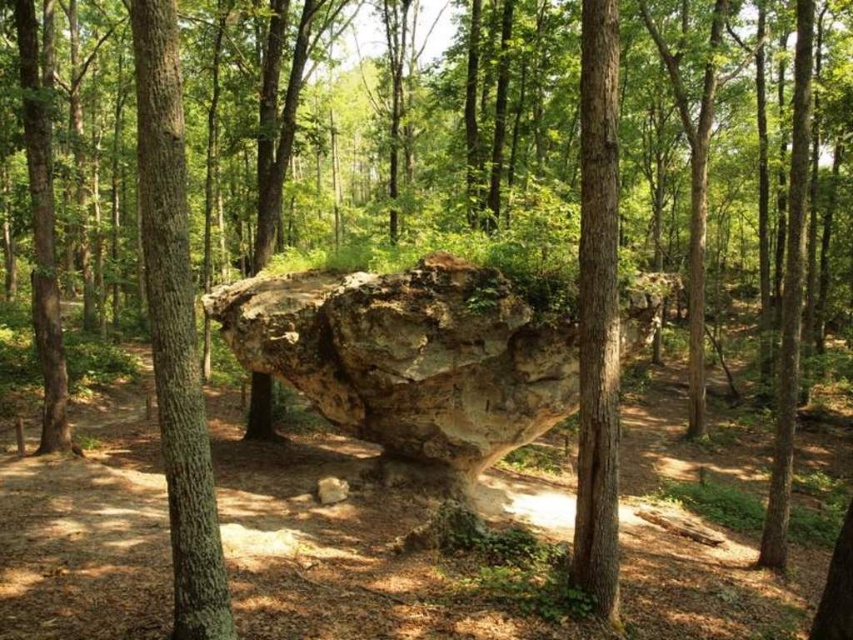
Question: Is brown rough tree trunk at center bigger than smooth bark tree at center?

Choices:
 (A) no
 (B) yes

Answer: (B)

Question: Which point is closer to the camera taking this photo?

Choices:
 (A) (613, 442)
 (B) (398, 340)
 (C) (181, 604)

Answer: (C)

Question: Can you confirm if brown rough tree trunk at center is positioned to the right of smooth bark tree at center?

Choices:
 (A) no
 (B) yes

Answer: (A)

Question: Which of the following is the closest to the observer?

Choices:
 (A) (596, 493)
 (B) (457, 356)

Answer: (A)

Question: Is rough textured rock at center bigger than smooth bark tree at center?

Choices:
 (A) no
 (B) yes

Answer: (B)

Question: Among these objects, which one is farthest from the camera?

Choices:
 (A) brown rough tree trunk at center
 (B) rough textured rock at center
 (C) smooth bark tree at center

Answer: (B)